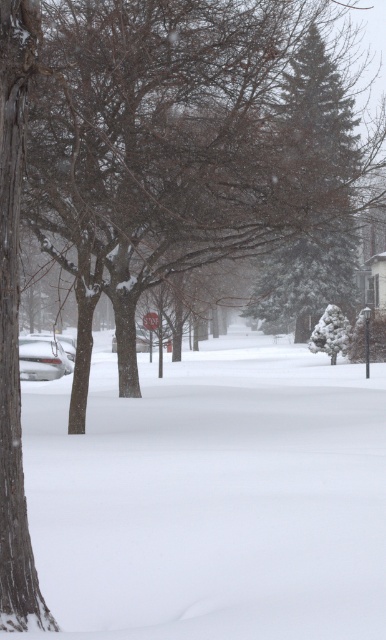
Is white fluffy snow at center below snow-covered tree at left?

Indeed, white fluffy snow at center is positioned under snow-covered tree at left.

Does white fluffy snow at center have a lesser height compared to snow-covered tree at left?

Yes.

The width and height of the screenshot is (386, 640). What do you see at coordinates (211, 499) in the screenshot? I see `white fluffy snow at center` at bounding box center [211, 499].

Identify the location of white fluffy snow at center. (211, 499).

Is point (54, 48) farther from viewer compared to point (282, 93)?

No.

Is snow-covered tree at left closer to the viewer compared to green textured pine tree at upper center?

Yes, snow-covered tree at left is in front of green textured pine tree at upper center.

Identify the location of snow-covered tree at left. The height and width of the screenshot is (640, 386). (182, 138).

Is white fluffy snow at center positioned at the back of green textured pine tree at upper center?

That is False.

Does point (365, 509) lie behind point (284, 154)?

No, it is not.

Identify the location of white fluffy snow at center. This screenshot has height=640, width=386. (211, 499).

Where is `white fluffy snow at center`? white fluffy snow at center is located at coordinates (211, 499).